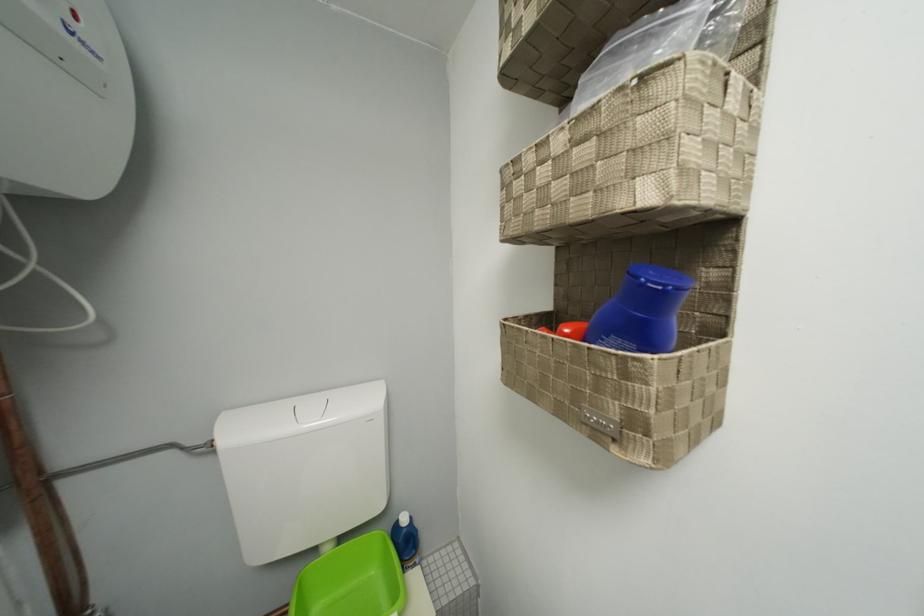
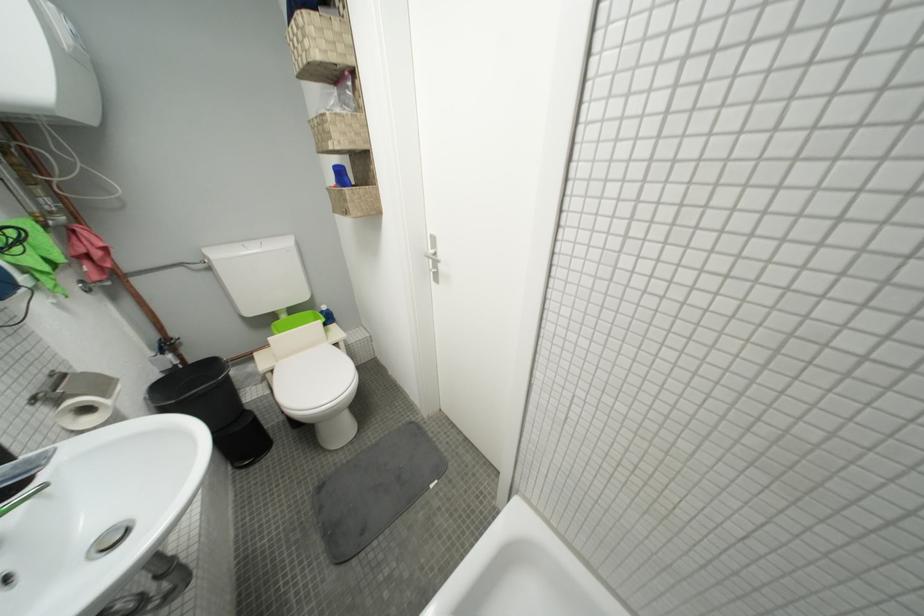
Where in the second image is the point corresponding to point 335,552 from the first image?

(293, 318)